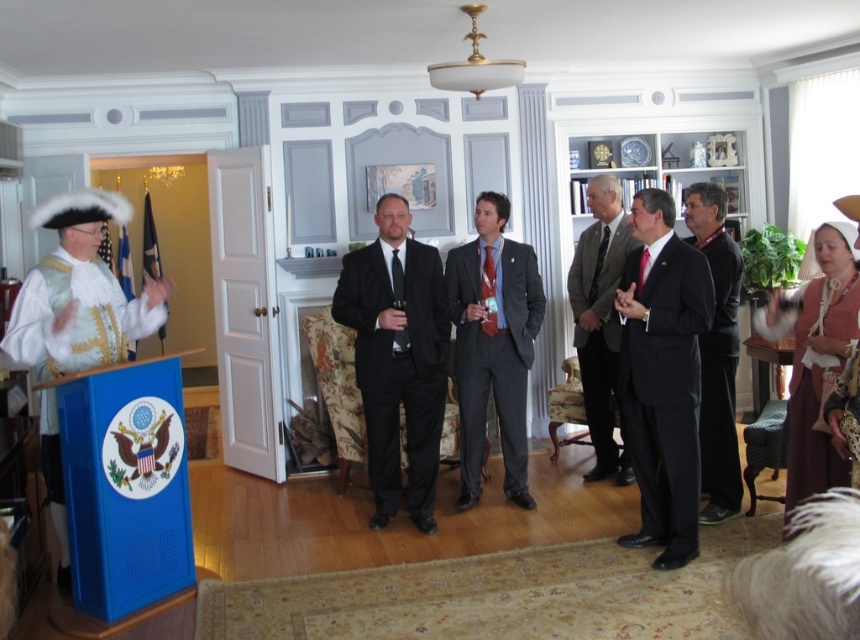
You are standing in the room and want to find the black satin suit at center. Based on the coordinates provided, can you estimate its position relative to the blue podium with the U.S. Great Seal?

The black satin suit at center is located at coordinates approximately 59.00 cm in the x direction and 77.10 cm in the y direction from the bottom left corner of the room. Since the blue podium with the U.S. Great Seal is in the foreground, the black satin suit at center is positioned to the right and above the podium.